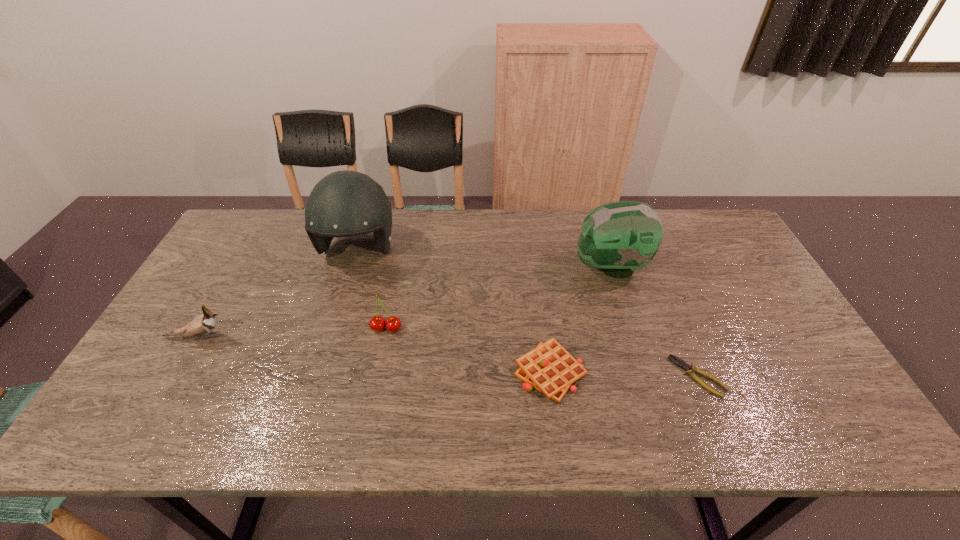
Identify the location of vacant space located 0.180m on the visor of the second tallest object. The height and width of the screenshot is (540, 960). (516, 267).

At what (x,y) coordinates should I click in order to perform the action: click on blank space located 0.270m on the visor of the second tallest object. Please return your answer as a coordinate pair (x, y). Looking at the image, I should click on (487, 267).

Find the location of a particular element. vacant space positioned 0.310m on the visor of the second tallest object is located at coordinates (473, 267).

At what (x,y) coordinates should I click in order to perform the action: click on free region located 0.250m at the face of the bird. Please return your answer as a coordinate pair (x, y). Looking at the image, I should click on (327, 338).

Image resolution: width=960 pixels, height=540 pixels. Identify the location of vacant region located with the stems of the cherry pointing upwards. (372, 399).

This screenshot has height=540, width=960. I want to click on vacant space located 0.370m on the left of the waffle, so click(x=365, y=372).

The image size is (960, 540). Find the location of `vacant space positioned on the left of the pliers`. vacant space positioned on the left of the pliers is located at coordinates (577, 376).

This screenshot has width=960, height=540. I want to click on object positioned at the left edge, so click(203, 324).

You are a GUI agent. You are given a task and a screenshot of the screen. Output one action in this format:
    pyautogui.click(x=<x>, y=<y>)
    Task: Click on the vacant area at the far edge of the desktop
    This screenshot has height=540, width=960.
    Given the screenshot: What is the action you would take?
    pyautogui.click(x=451, y=225)

Find the location of a particular element. The image size is (960, 540). free space at the near edge of the desktop is located at coordinates (696, 441).